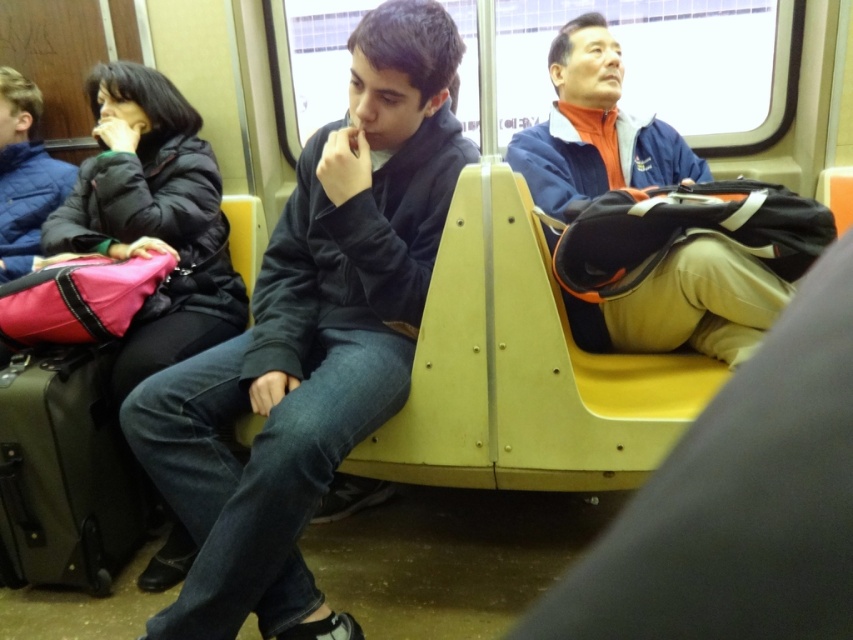
Question: Is dark blue hoodie at center thinner than olive green fabric suitcase at lower left?

Choices:
 (A) yes
 (B) no

Answer: (B)

Question: Which object appears farthest from the camera in this image?

Choices:
 (A) blue fabric jacket at right
 (B) dark blue hoodie at center
 (C) olive green fabric suitcase at lower left

Answer: (C)

Question: Does dark blue hoodie at center have a lesser width compared to olive green fabric suitcase at lower left?

Choices:
 (A) no
 (B) yes

Answer: (A)

Question: Can you confirm if dark blue hoodie at center is positioned above blue fabric jacket at right?

Choices:
 (A) yes
 (B) no

Answer: (B)

Question: Among these objects, which one is farthest from the camera?

Choices:
 (A) dark blue hoodie at center
 (B) blue fabric jacket at right

Answer: (B)

Question: Considering the real-world distances, which object is closest to the olive green fabric suitcase at lower left?

Choices:
 (A) blue fabric jacket at right
 (B) dark blue hoodie at center

Answer: (B)